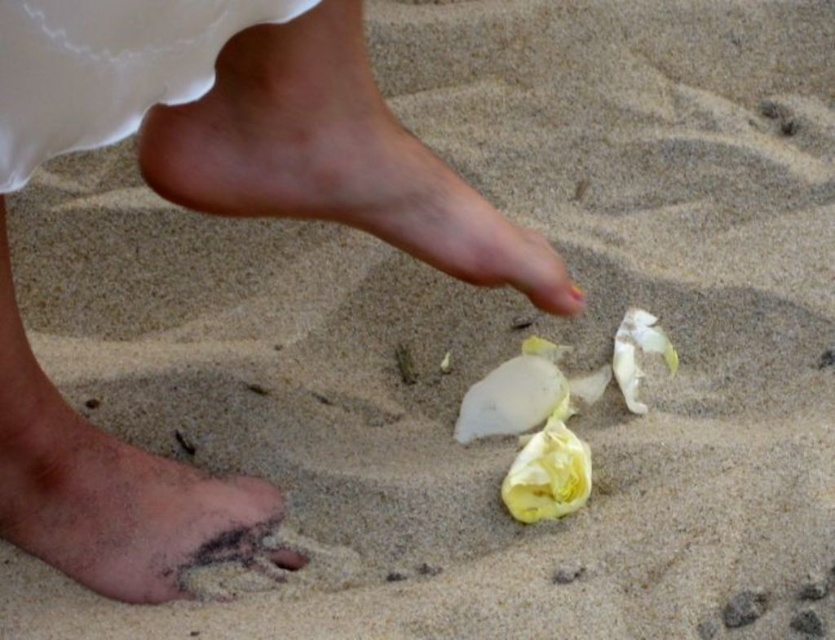
Question: Which object is the closest to the smooth skin foot at lower left?

Choices:
 (A) brown sandy foot at lower left
 (B) pink skin at center

Answer: (B)

Question: Is smooth skin foot at lower left thinner than brown sandy foot at lower left?

Choices:
 (A) yes
 (B) no

Answer: (B)

Question: Does pink skin at center appear under brown sandy foot at lower left?

Choices:
 (A) yes
 (B) no

Answer: (B)

Question: Which of the following is the closest to the observer?

Choices:
 (A) pink skin at center
 (B) brown sandy foot at lower left

Answer: (A)

Question: Which object appears farthest from the camera in this image?

Choices:
 (A) pink skin at center
 (B) brown sandy foot at lower left
 (C) smooth skin foot at lower left

Answer: (B)

Question: Is the position of pink skin at center less distant than that of brown sandy foot at lower left?

Choices:
 (A) no
 (B) yes

Answer: (B)